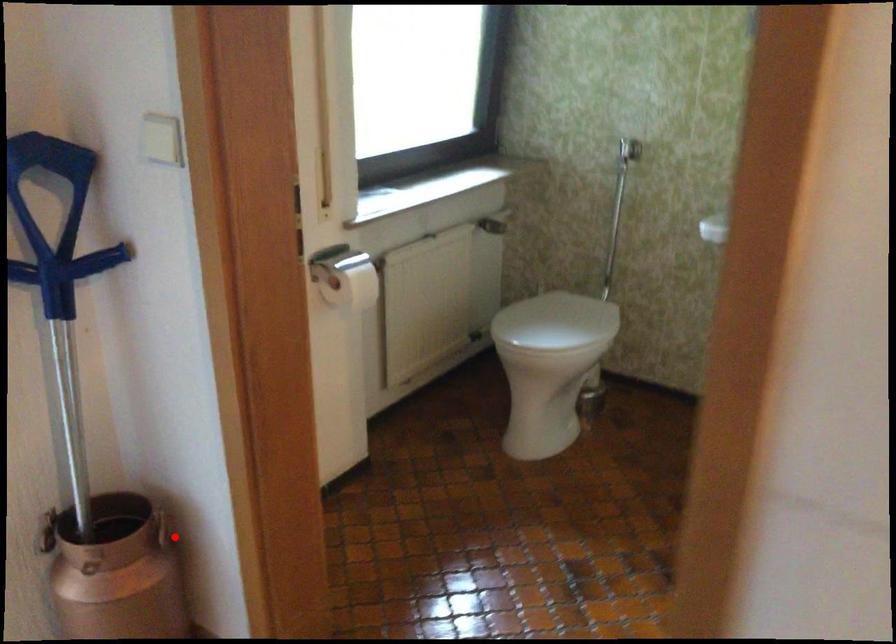
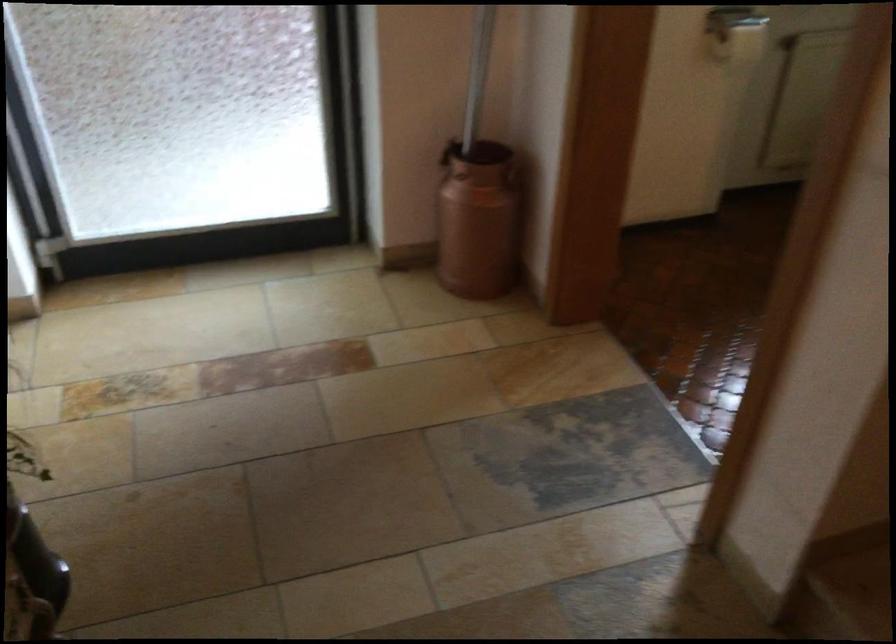
Question: I am providing you with two images of the same scene from different viewpoints. Image1 has a red point marked. In image2, the corresponding 3D location appears at what relative position? Reply with the corresponding letter.

Choices:
 (A) Closer
 (B) Farther

Answer: (B)